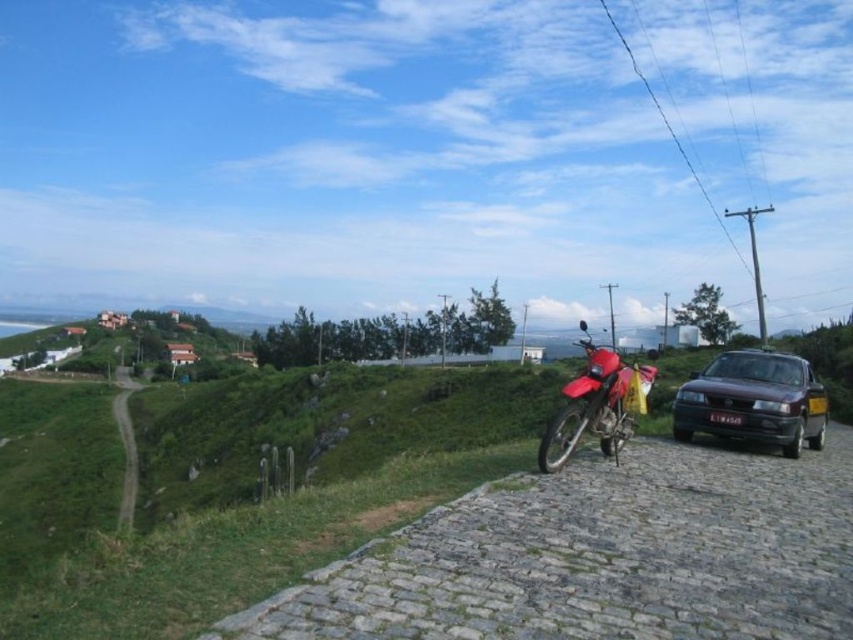
Is point (717, 420) behind point (810, 406)?

No, it is not.

Is point (717, 417) behind point (814, 403)?

No.

Image resolution: width=853 pixels, height=640 pixels. In order to click on black plastic license plate at center in this screenshot , I will do `click(724, 419)`.

Who is lower down, red matte motorcycle at center or shiny red motorcycle at center?

red matte motorcycle at center

Is point (233, 428) positioned after point (549, 451)?

Yes, it is behind point (549, 451).

This screenshot has width=853, height=640. Find the location of `red matte motorcycle at center`. red matte motorcycle at center is located at coordinates (236, 488).

In the scene shown: Who is higher up, red matte motorcycle at center or black plastic license plate at center?

black plastic license plate at center is above.

Who is taller, red matte motorcycle at center or black plastic license plate at center?

Standing taller between the two is red matte motorcycle at center.

Describe the element at coordinates (236, 488) in the screenshot. I see `red matte motorcycle at center` at that location.

The image size is (853, 640). I want to click on red matte motorcycle at center, so click(236, 488).